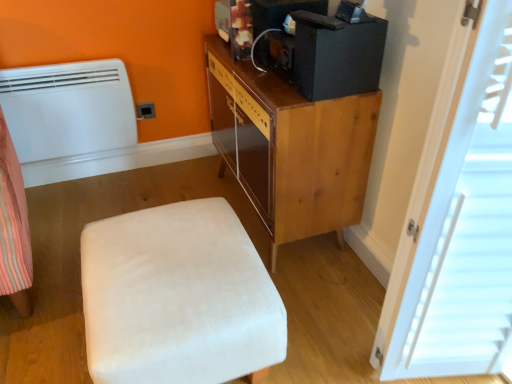
Identify the location of free space to the right of white velvety ottoman at lower left. (326, 311).